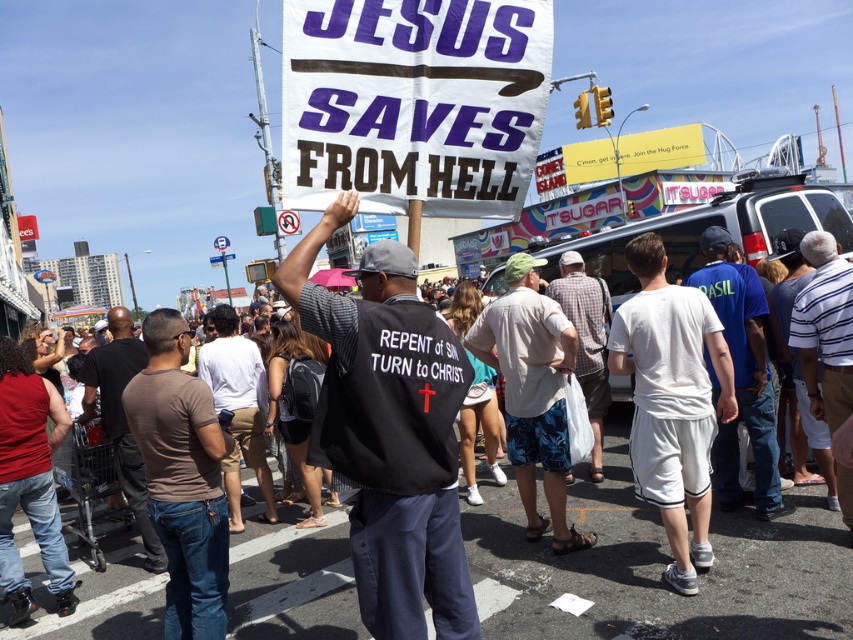
You are a photographer trying to capture a clear image of the two shirts at the center of the crowd. Given that the white striped shirt at center is thinner than the white cotton shirt at center, which one would be easier to focus on and why?

The white striped shirt at center is thinner than the white cotton shirt at center, so it would be easier to focus on because its narrower width allows for quicker and more precise focusing compared to the wider cotton shirt.

You are a photographer trying to capture a clear shot of both the white striped shirt at center and the white cotton shirt at center. Since you can only focus on one shirt at a time, which shirt should you focus on first to ensure the other is still in the frame?

The white striped shirt at center is to the right of the white cotton shirt at center. Therefore, focusing on the white cotton shirt at center first would allow the photographer to pan right to include the white striped shirt at center in the frame without losing it.